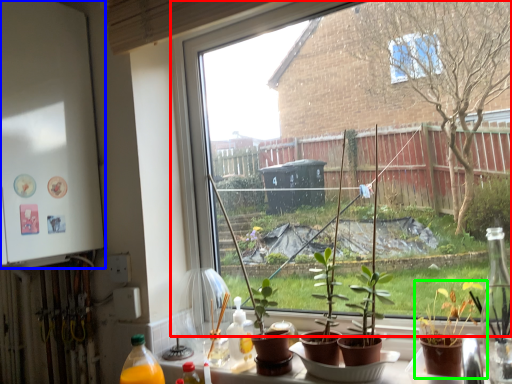
Question: Estimate the real-world distances between objects in this image. Which object is closer to window (highlighted by a red box), back (highlighted by a blue box) or houseplant (highlighted by a green box)?

Choices:
 (A) back
 (B) houseplant

Answer: (A)